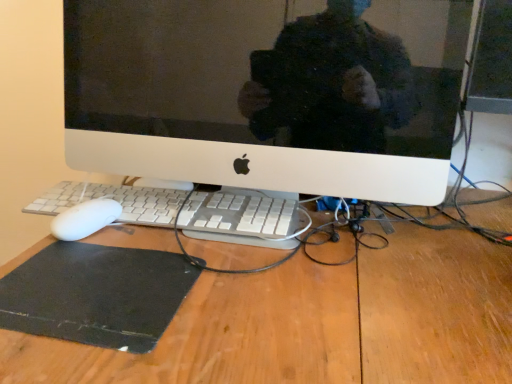
At what (x,y) coordinates should I click in order to perform the action: click on vacant space that's between white plastic keyboard at center and black rubber mousepad at lower left. Please return your answer as a coordinate pair (x, y). The image size is (512, 384). Looking at the image, I should click on (210, 267).